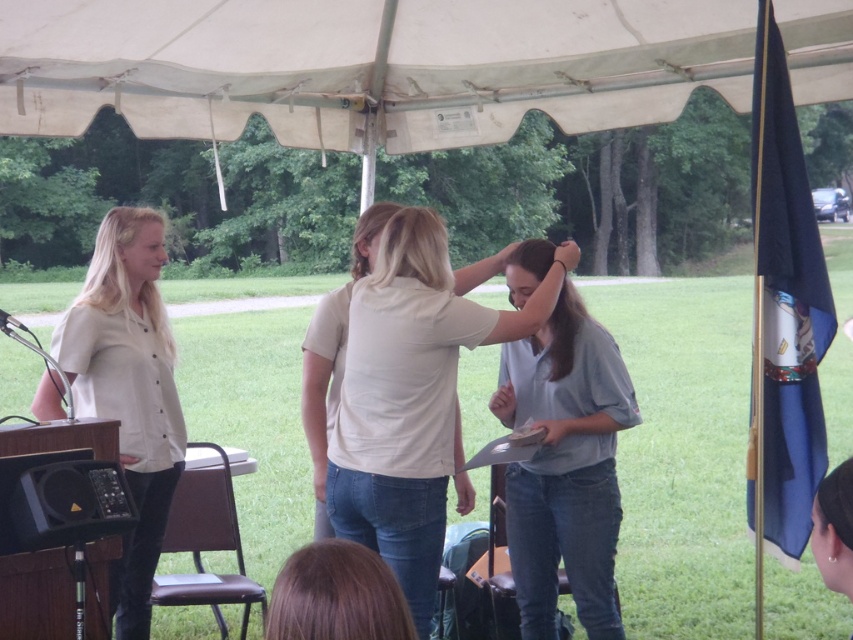
Is point (625, 385) farther from camera compared to point (161, 237)?

No, (625, 385) is closer to viewer.

Based on the photo, which of these two, light blue denim shirt at center or matte white blouse at left, stands taller?

Standing taller between the two is matte white blouse at left.

Who is more forward, (x=563, y=301) or (x=132, y=442)?

Point (x=563, y=301) is in front.

Locate an element on the screen. This screenshot has height=640, width=853. light blue denim shirt at center is located at coordinates point(566,467).

Who is positioned more to the right, white fabric canopy at upper center or light blue denim shirt at center?

light blue denim shirt at center is more to the right.

Is white fabric canopy at upper center to the left of light blue denim shirt at center from the viewer's perspective?

Correct, you'll find white fabric canopy at upper center to the left of light blue denim shirt at center.

Where is `white fabric canopy at upper center`? Image resolution: width=853 pixels, height=640 pixels. white fabric canopy at upper center is located at coordinates (364, 67).

Can you confirm if light blue denim shirt at center is positioned below matte black speaker at lower left?

No.

Describe the element at coordinates (566, 467) in the screenshot. This screenshot has height=640, width=853. I see `light blue denim shirt at center` at that location.

Does point (544, 556) lie behind point (91, 520)?

Yes.

Locate an element on the screen. light blue denim shirt at center is located at coordinates (566, 467).